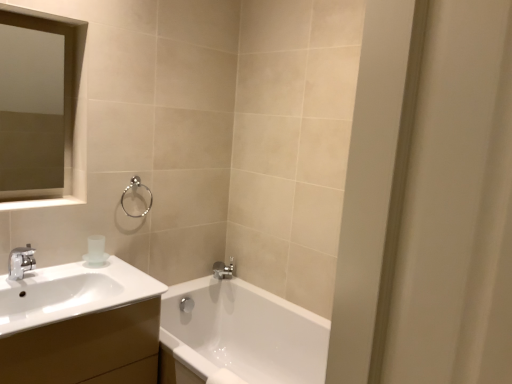
Where is `free location in front of matte glass medicine cabinet at upper left`? The width and height of the screenshot is (512, 384). free location in front of matte glass medicine cabinet at upper left is located at coordinates (20, 201).